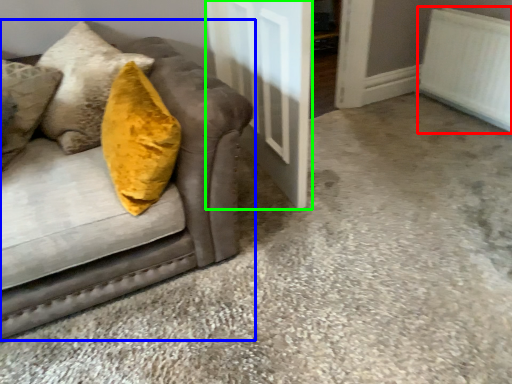
Question: Estimate the real-world distances between objects in this image. Which object is farther from radiator (highlighted by a red box), studio couch (highlighted by a blue box) or door (highlighted by a green box)?

Choices:
 (A) studio couch
 (B) door

Answer: (A)